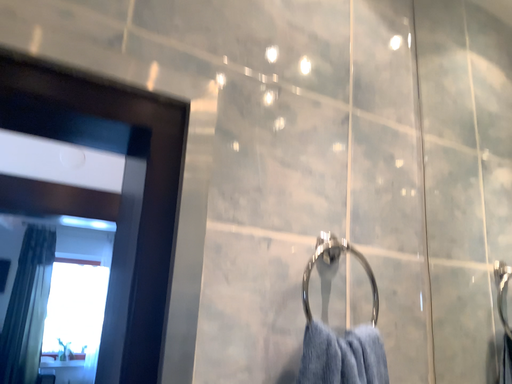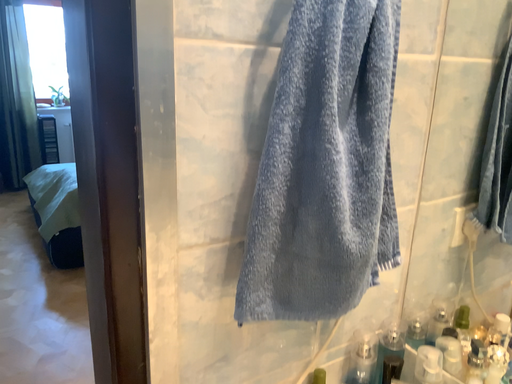
Question: Which way did the camera rotate in the video?

Choices:
 (A) rotated upward
 (B) rotated downward

Answer: (B)